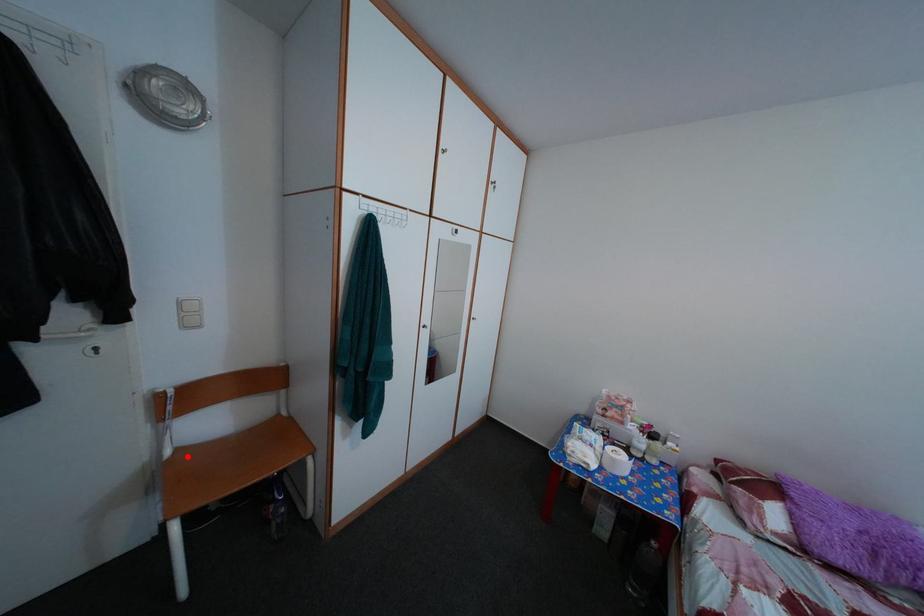
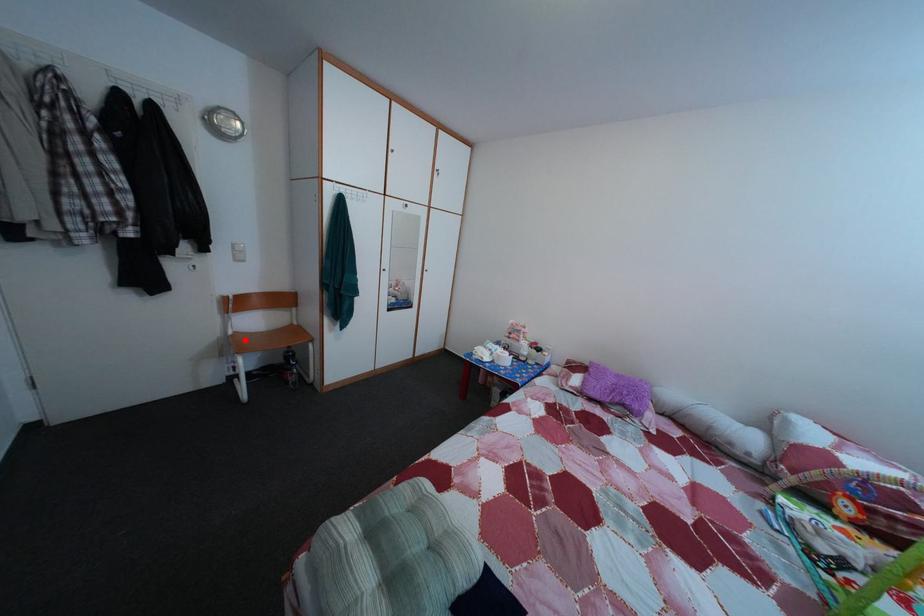
I am providing you with two images of the same scene from different viewpoints. A red point is marked on the first image and another point is marked on the second image. Does the point marked in image1 correspond to the same location as the one in image2?

Yes